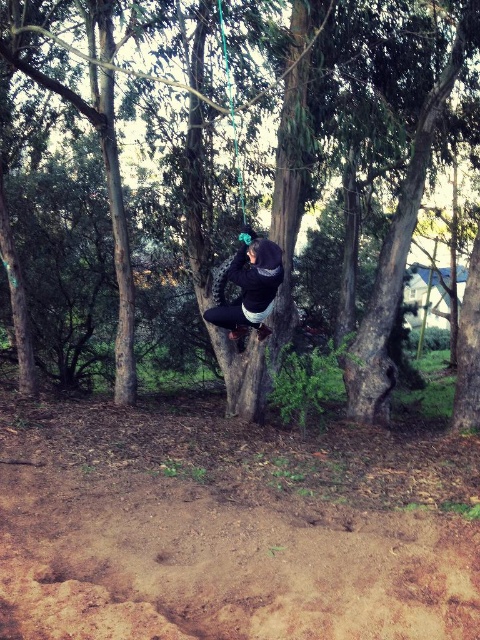
Question: Which is nearer to the brown rough tree trunk at center?

Choices:
 (A) dark blue fleece jacket at center
 (B) brown dirt track at lower center

Answer: (A)

Question: Is brown rough tree trunk at center thinner than dark blue fleece jacket at center?

Choices:
 (A) no
 (B) yes

Answer: (B)

Question: Considering the real-world distances, which object is closest to the brown dirt track at lower center?

Choices:
 (A) brown rough tree trunk at center
 (B) dark blue fleece jacket at center

Answer: (B)

Question: Is brown dirt track at lower center wider than dark blue fleece jacket at center?

Choices:
 (A) no
 (B) yes

Answer: (B)

Question: Which of these objects is positioned farthest from the brown rough tree trunk at center?

Choices:
 (A) brown dirt track at lower center
 (B) dark blue fleece jacket at center

Answer: (A)

Question: Considering the relative positions of brown rough tree trunk at center and dark blue fleece jacket at center in the image provided, where is brown rough tree trunk at center located with respect to dark blue fleece jacket at center?

Choices:
 (A) above
 (B) below

Answer: (A)